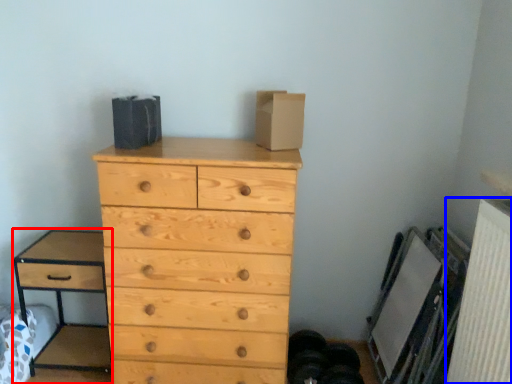
Question: Which point is further to the camera, nightstand (highlighted by a red box) or radiator (highlighted by a blue box)?

Choices:
 (A) nightstand
 (B) radiator

Answer: (A)